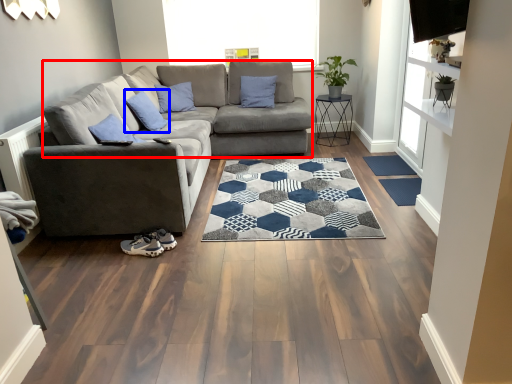
Question: Which object is closer to the camera taking this photo, couch (highlighted by a red box) or pillow (highlighted by a blue box)?

Choices:
 (A) couch
 (B) pillow

Answer: (B)